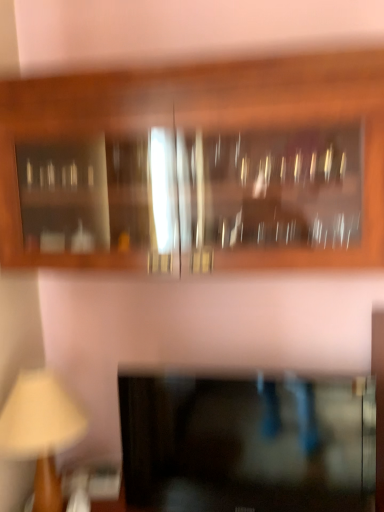
Question: In which direction should I rotate to look at black glass cabinet at lower center, the first cabinetry ordered from the bottom?

Choices:
 (A) right
 (B) left

Answer: (A)

Question: Is black glass cabinet at lower center, which ranks as the second cabinetry in top-to-bottom order, to the right of wooden cabinet at upper center, the second cabinetry from the bottom, from the viewer's perspective?

Choices:
 (A) yes
 (B) no

Answer: (A)

Question: Is the surface of black glass cabinet at lower center, the first cabinetry ordered from the bottom, in direct contact with wooden cabinet at upper center, the second cabinetry from the bottom?

Choices:
 (A) yes
 (B) no

Answer: (B)

Question: Is black glass cabinet at lower center, the first cabinetry ordered from the bottom, closer to camera compared to wooden cabinet at upper center, marked as the 1th cabinetry in a top-to-bottom arrangement?

Choices:
 (A) no
 (B) yes

Answer: (A)

Question: Considering the relative sizes of black glass cabinet at lower center, the first cabinetry ordered from the bottom, and wooden cabinet at upper center, marked as the 1th cabinetry in a top-to-bottom arrangement, in the image provided, is black glass cabinet at lower center, the first cabinetry ordered from the bottom, shorter than wooden cabinet at upper center, marked as the 1th cabinetry in a top-to-bottom arrangement,?

Choices:
 (A) no
 (B) yes

Answer: (B)

Question: From a real-world perspective, is black glass cabinet at lower center, which ranks as the second cabinetry in top-to-bottom order, on top of wooden cabinet at upper center, marked as the 1th cabinetry in a top-to-bottom arrangement?

Choices:
 (A) no
 (B) yes

Answer: (A)

Question: From a real-world perspective, is black glass cabinet at lower center, the first cabinetry ordered from the bottom, physically below wooden cabinet at upper center, the second cabinetry from the bottom?

Choices:
 (A) no
 (B) yes

Answer: (B)

Question: From a real-world perspective, is wooden cabinet at upper center, the second cabinetry from the bottom, physically below wooden beige table lamp at lower left?

Choices:
 (A) yes
 (B) no

Answer: (B)

Question: Is wooden cabinet at upper center, marked as the 1th cabinetry in a top-to-bottom arrangement, facing away from wooden beige table lamp at lower left?

Choices:
 (A) no
 (B) yes

Answer: (A)

Question: Could you tell me if wooden cabinet at upper center, the second cabinetry from the bottom, is facing wooden beige table lamp at lower left?

Choices:
 (A) yes
 (B) no

Answer: (B)

Question: Considering the relative sizes of wooden cabinet at upper center, the second cabinetry from the bottom, and wooden beige table lamp at lower left in the image provided, is wooden cabinet at upper center, the second cabinetry from the bottom, taller than wooden beige table lamp at lower left?

Choices:
 (A) no
 (B) yes

Answer: (B)

Question: Would you say wooden cabinet at upper center, marked as the 1th cabinetry in a top-to-bottom arrangement, contains wooden beige table lamp at lower left?

Choices:
 (A) no
 (B) yes

Answer: (A)

Question: Are wooden cabinet at upper center, marked as the 1th cabinetry in a top-to-bottom arrangement, and wooden beige table lamp at lower left far apart?

Choices:
 (A) no
 (B) yes

Answer: (A)

Question: Is wooden cabinet at upper center, the second cabinetry from the bottom, a part of wooden beige table lamp at lower left?

Choices:
 (A) no
 (B) yes

Answer: (A)